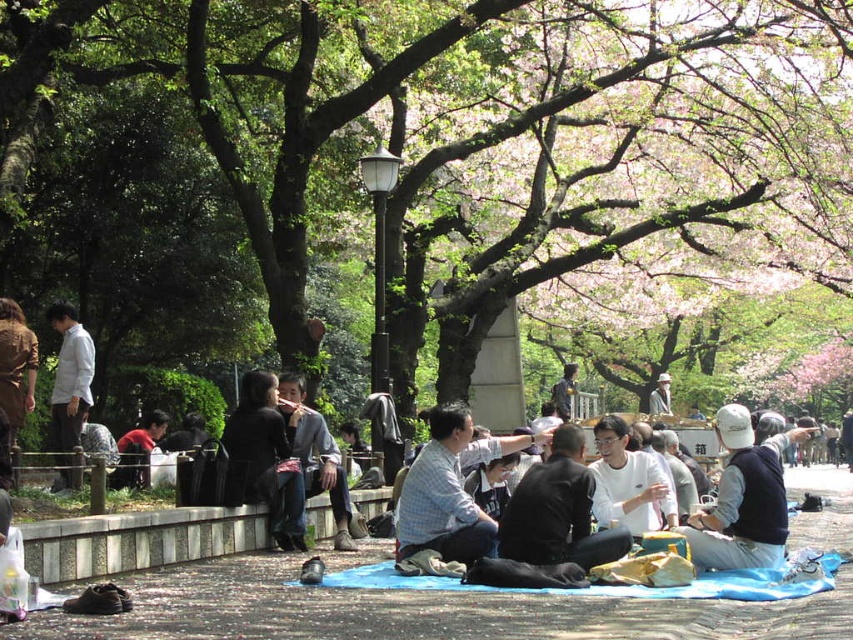
You are at a park picnic and want to retrieve your black leather jacket at center to put it on. However, there is a dark gray sweater at center in the way. Can you reach your jacket without moving the sweater?

The black leather jacket at center is in front of the dark gray sweater at center, so you can reach it without moving the sweater.

You are a photographer trying to capture a candid shot of the people on the picnic blanket. You notice the white matte shirt at center and the light gray fabric jacket at center. Which clothing item is positioned higher on the person?

The white matte shirt at center is located above the light gray fabric jacket at center, so the white matte shirt at center is positioned higher on the person.